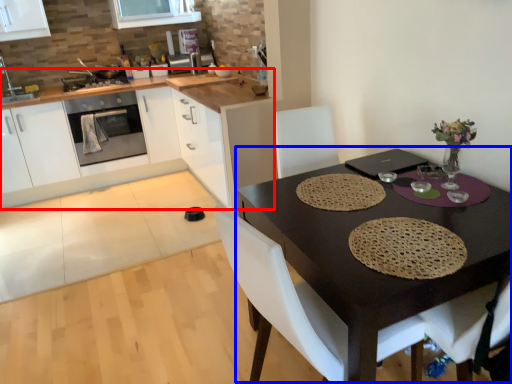
Question: Which object is further to the camera taking this photo, countertop (highlighted by a red box) or round table (highlighted by a blue box)?

Choices:
 (A) countertop
 (B) round table

Answer: (A)